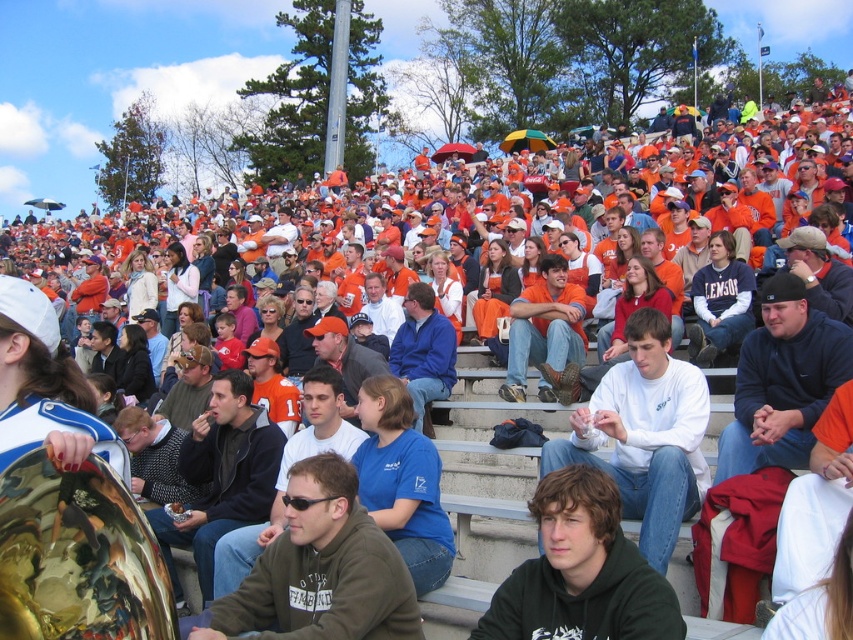
Question: Does blue cotton shirt at center appear under matte black jacket at center?

Choices:
 (A) yes
 (B) no

Answer: (A)

Question: Which is farther from the dark gray hoodie at center?

Choices:
 (A) white matte shirt at center
 (B) black fleece jacket at center

Answer: (B)

Question: From the image, what is the correct spatial relationship of dark gray hoodie at center in relation to blue cotton shirt at center?

Choices:
 (A) left
 (B) right

Answer: (A)

Question: Can you confirm if dark green hoodie at center is positioned below matte black jacket at center?

Choices:
 (A) yes
 (B) no

Answer: (A)

Question: Which point appears closest to the camera in this image?

Choices:
 (A) (532, 636)
 (B) (416, 362)

Answer: (A)

Question: Among these objects, which one is farthest from the camera?

Choices:
 (A) dark blue jacket at center
 (B) matte orange shirt at center
 (C) dark gray hoodie at center
 (D) blue cotton shirt at center

Answer: (D)